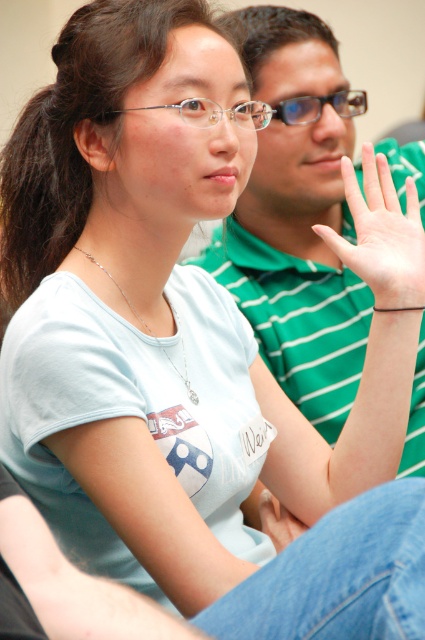
You are a photographer trying to capture a closeup of the clear plastic glasses at center in the image. However, the pale skin hand at center is blocking your view. Can you adjust your angle to see the glasses without moving any objects?

The clear plastic glasses at center is behind the pale skin hand at center, so you can adjust your angle to see around the hand and capture the glasses without moving anything.

You are a delivery person standing at the entrance of a room. You need to deliver a package to the clear plastic glasses at center. The delivery robot you are using has a maximum reach of 1 meter. Can the robot reach the glasses from your current position?

The clear plastic glasses at center and viewer are 1.11 meters apart, so the robot cannot reach the glasses as its maximum reach is 1 meter.